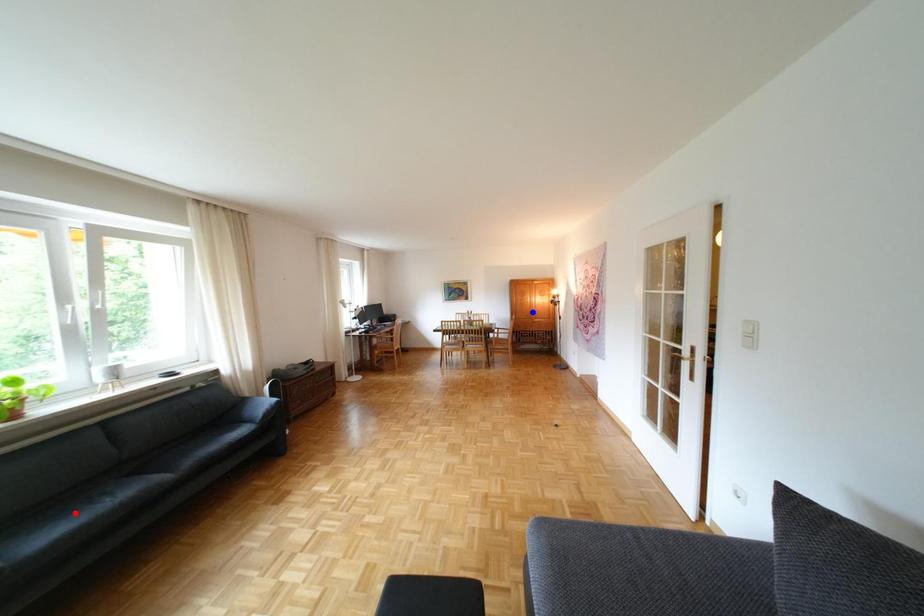
Question: Which of the two points in the image is closer to the camera?

Choices:
 (A) Blue point is closer.
 (B) Red point is closer.

Answer: (B)